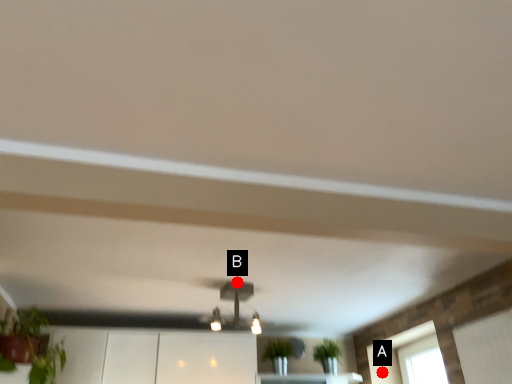
Question: Two points are circled on the image, labeled by A and B beside each circle. Which point is farther to the camera?

Choices:
 (A) A is further
 (B) B is further

Answer: (A)